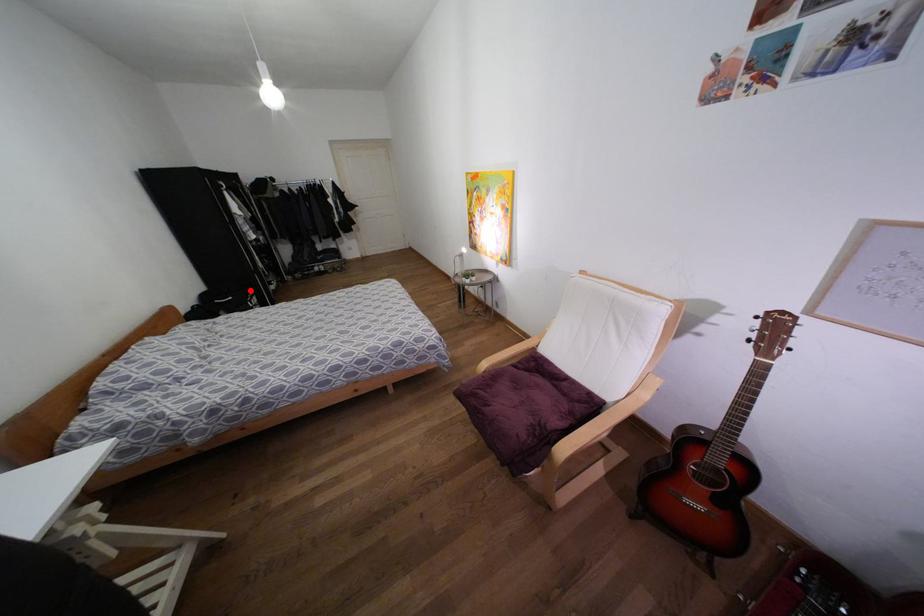
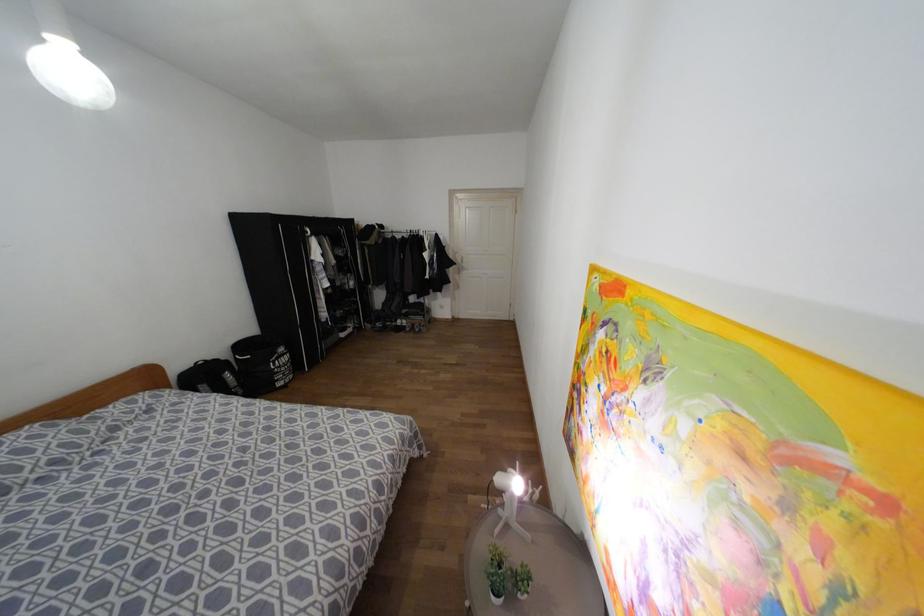
Locate, in the second image, the point that corresponds to the highlighted location in the first image.

(281, 349)